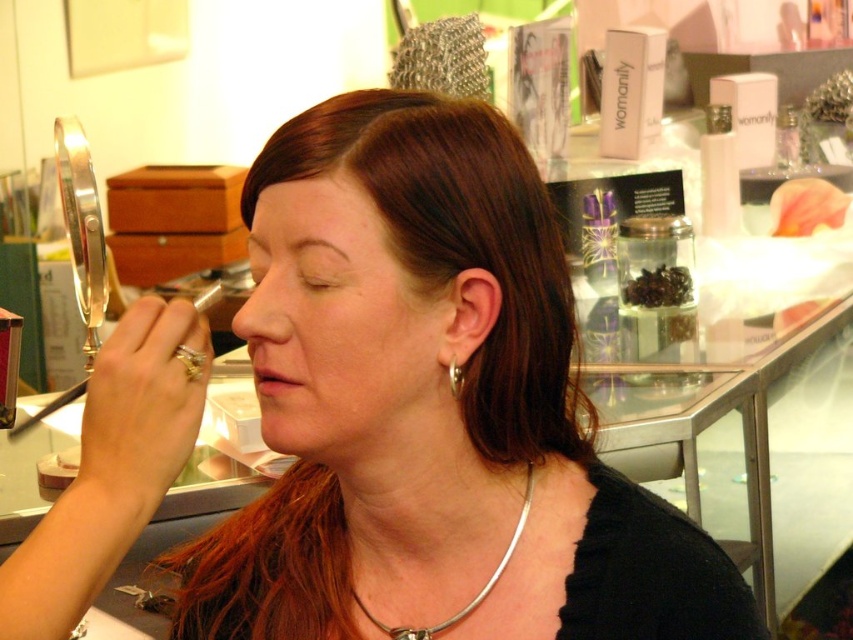
You are a jeweler who needs to place the silver metallic necklace at center into a display case that is 24 inches wide. Can the necklace fit inside the case?

The silver metallic necklace at center is 24.92 inches in length, so it cannot fit into the 24 inch wide display case as it is slightly longer than the case width.

You are a makeup artist working on a client. You have a silver metallic necklace at center and a gold shiny earring at ear. The client wants to know if the necklace and earring will be visible together in a photo taken from the front. Based on their positions, can you confirm if both will be in the frame?

The silver metallic necklace at center is 6.25 inches away from the gold shiny earring at ear. Since both items are positioned on the client and within a typical framing distance, they will both be visible in the photo taken from the front.

You are a photographer in the beauty studio. You need to adjust the lighting so that the silver metallic necklace at center and the gold shiny earring at ear are both clearly visible. Which object should you focus on first to ensure proper lighting?

The silver metallic necklace at center should be focused on first because it is closer to the viewer than the gold shiny earring at ear, so adjusting the lighting for it first ensures both are properly illuminated.